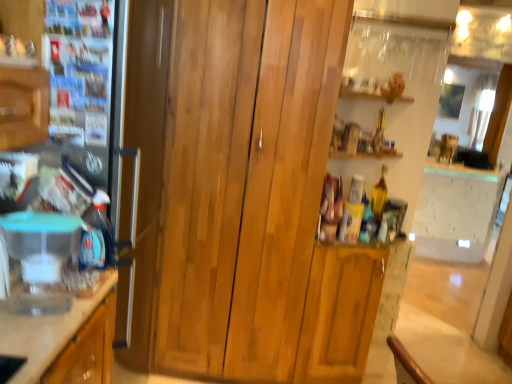
Question: Does wooden cabinet at center appear on the left side of transparent plastic container at left?

Choices:
 (A) no
 (B) yes

Answer: (A)

Question: Considering the relative sizes of wooden cabinet at center and transparent plastic container at left in the image provided, is wooden cabinet at center bigger than transparent plastic container at left?

Choices:
 (A) yes
 (B) no

Answer: (A)

Question: Does wooden cabinet at center come in front of transparent plastic container at left?

Choices:
 (A) no
 (B) yes

Answer: (A)

Question: From a real-world perspective, is wooden cabinet at center positioned under transparent plastic container at left based on gravity?

Choices:
 (A) no
 (B) yes

Answer: (A)

Question: Is wooden cabinet at center shorter than transparent plastic container at left?

Choices:
 (A) no
 (B) yes

Answer: (A)

Question: Can you confirm if wooden cabinet at center is thinner than transparent plastic container at left?

Choices:
 (A) yes
 (B) no

Answer: (B)

Question: Is wooden cabinet at center at the right side of satin silver fridge at left?

Choices:
 (A) no
 (B) yes

Answer: (B)

Question: Can you confirm if wooden cabinet at center is shorter than satin silver fridge at left?

Choices:
 (A) yes
 (B) no

Answer: (B)

Question: Does wooden cabinet at center lie behind satin silver fridge at left?

Choices:
 (A) no
 (B) yes

Answer: (B)

Question: Does wooden cabinet at center have a greater width compared to satin silver fridge at left?

Choices:
 (A) yes
 (B) no

Answer: (B)

Question: Is wooden cabinet at center smaller than satin silver fridge at left?

Choices:
 (A) no
 (B) yes

Answer: (A)

Question: Does wooden cabinet at center have a greater height compared to satin silver fridge at left?

Choices:
 (A) yes
 (B) no

Answer: (A)

Question: Is satin silver fridge at left shorter than clear plastic container at left?

Choices:
 (A) yes
 (B) no

Answer: (B)